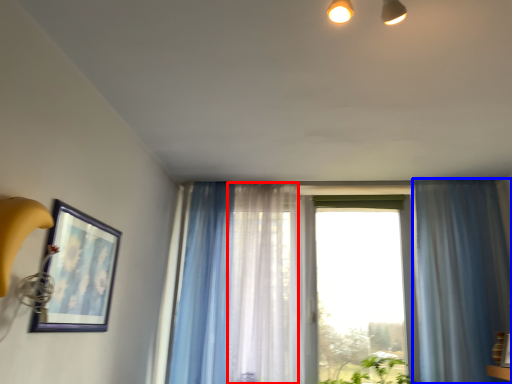
Question: Which of the following is the farthest to the observer, curtain (highlighted by a red box) or curtain (highlighted by a blue box)?

Choices:
 (A) curtain
 (B) curtain

Answer: (A)